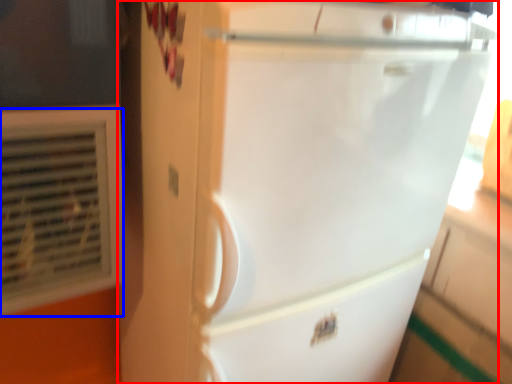
Question: Which of the following is the closest to the observer, refrigerator (highlighted by a red box) or air conditioning (highlighted by a blue box)?

Choices:
 (A) refrigerator
 (B) air conditioning

Answer: (A)